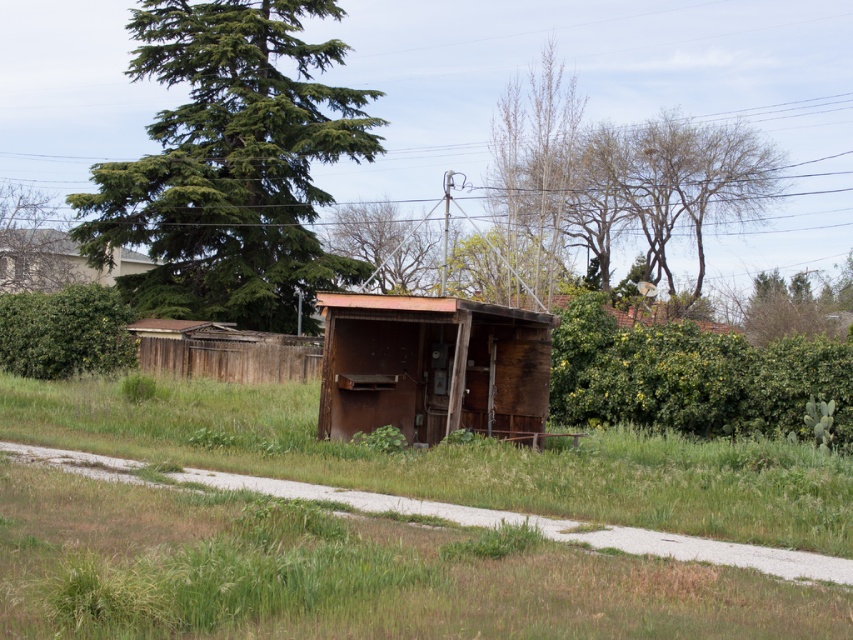
Question: Does green grass at center appear over green needle-like leaves at upper left?

Choices:
 (A) yes
 (B) no

Answer: (B)

Question: Does wooden shack at upper left lie behind wooden hut at center?

Choices:
 (A) yes
 (B) no

Answer: (A)

Question: Which object appears closest to the camera in this image?

Choices:
 (A) weathered wood hut at center
 (B) green needle-like leaves at upper left
 (C) green leafy tree at upper left

Answer: (A)

Question: Based on their relative distances, which object is nearer to the wooden hut at center?

Choices:
 (A) green needle-like leaves at upper left
 (B) bare wood tree at upper right
 (C) weathered wood hut at center
 (D) green grass at center

Answer: (C)

Question: Which point is farther to the camera?

Choices:
 (A) green needle-like leaves at upper left
 (B) weathered wood hut at center
 (C) green leafy tree at upper left
 (D) wooden shack at upper left

Answer: (C)

Question: Can you confirm if green leafy tree at upper center is positioned to the right of wooden shack at upper left?

Choices:
 (A) no
 (B) yes

Answer: (B)